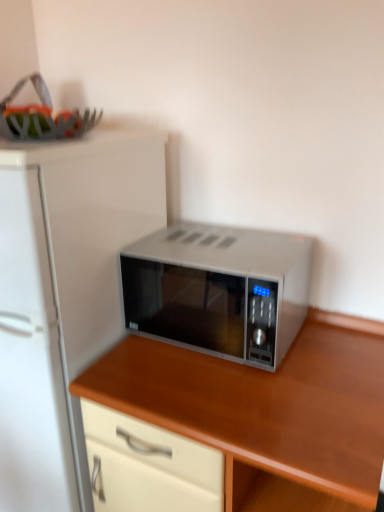
Identify the location of free space in front of satin silver microwave at center. Image resolution: width=384 pixels, height=512 pixels. (246, 394).